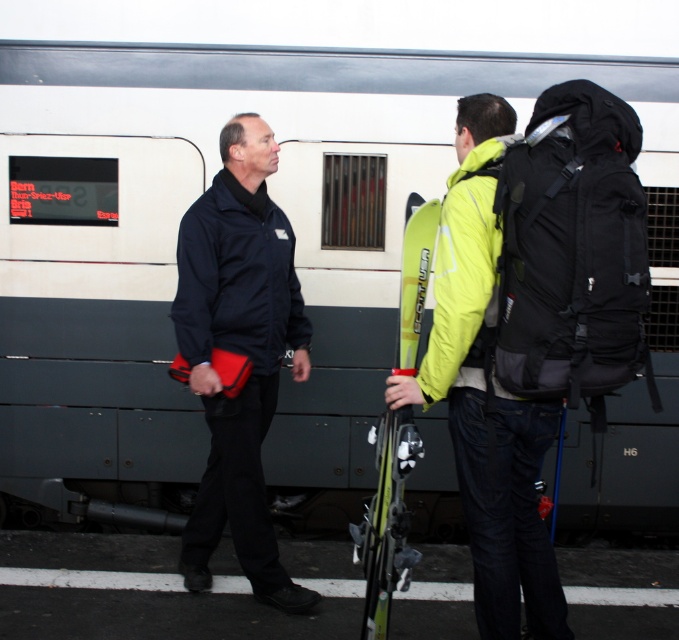
You are a photographer standing on the train platform. You want to take a photo of the neon yellow jacket at center and the yellow matte ski at center such that the jacket is not blocking the ski. Is this possible?

The neon yellow jacket at center is in front of the yellow matte ski at center, so to avoid blocking the ski, the photographer should adjust the angle or position to ensure the jacket is not obscuring the ski.

You are standing at the train platform and want to take a photo of the black matte jacket at center. Your camera is on a tripod 1.5 meters tall. Can you fit the entire jacket into the frame without moving the camera?

The black matte jacket at center and camera are 3.47 meters apart. With the camera on a 1.5 meter tripod, the jacket is within the camera frame range, so yes, you can fit the entire jacket into the frame without moving the camera.